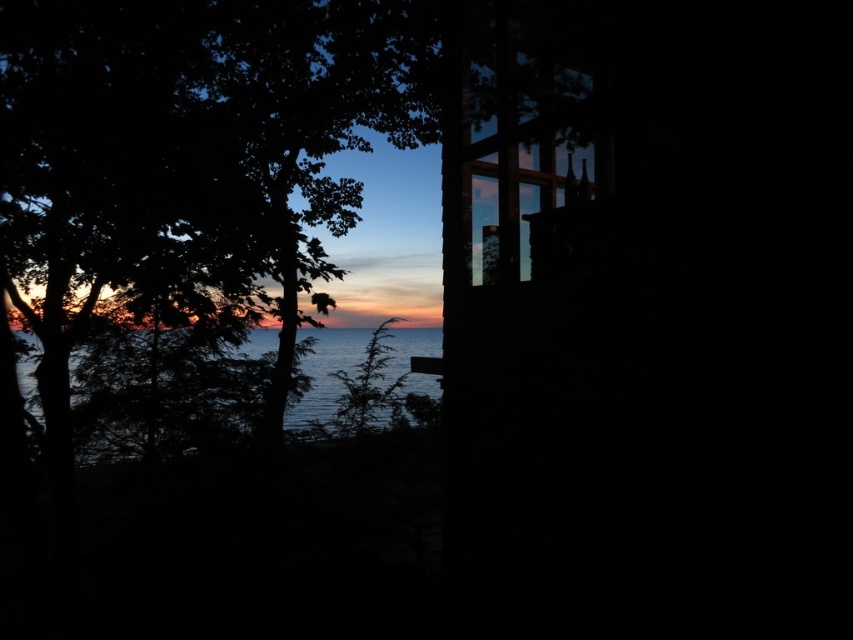
Looking at this image, is transparent glass window at center to the left of blue water at left from the viewer's perspective?

In fact, transparent glass window at center is to the right of blue water at left.

The height and width of the screenshot is (640, 853). Identify the location of transparent glass window at center. (524, 154).

What do you see at coordinates (524, 154) in the screenshot? I see `transparent glass window at center` at bounding box center [524, 154].

The height and width of the screenshot is (640, 853). What are the coordinates of `transparent glass window at center` in the screenshot? It's located at (524, 154).

Who is higher up, dark green leafy tree at left or blue water at left?

Positioned higher is dark green leafy tree at left.

Can you confirm if dark green leafy tree at left is positioned to the left of blue water at left?

Incorrect, dark green leafy tree at left is not on the left side of blue water at left.

Identify the location of dark green leafy tree at left. click(x=200, y=136).

Is dark green leafy tree at left to the left of transparent glass window at center from the viewer's perspective?

Correct, you'll find dark green leafy tree at left to the left of transparent glass window at center.

What do you see at coordinates (200, 136) in the screenshot? I see `dark green leafy tree at left` at bounding box center [200, 136].

Where is `dark green leafy tree at left`? dark green leafy tree at left is located at coordinates (200, 136).